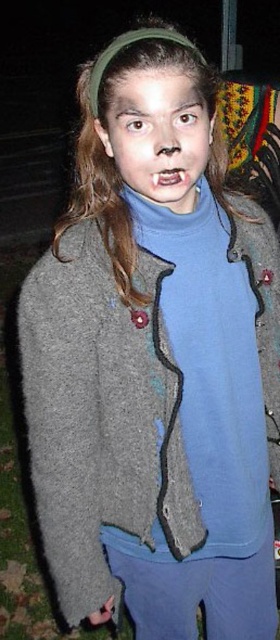
Question: Which of the following is the farthest from the observer?

Choices:
 (A) (187, 173)
 (B) (140, 179)

Answer: (A)

Question: Is matte skin face at center bigger than teeth white glossy at center?

Choices:
 (A) no
 (B) yes

Answer: (B)

Question: Can you confirm if matte skin face at center is bigger than teeth white glossy at center?

Choices:
 (A) no
 (B) yes

Answer: (B)

Question: Which of the following is the closest to the observer?

Choices:
 (A) matte skin face at center
 (B) teeth white glossy at center

Answer: (A)

Question: Which point is closer to the camera?

Choices:
 (A) matte skin face at center
 (B) teeth white glossy at center

Answer: (A)

Question: Can you confirm if matte skin face at center is positioned to the left of teeth white glossy at center?

Choices:
 (A) no
 (B) yes

Answer: (B)